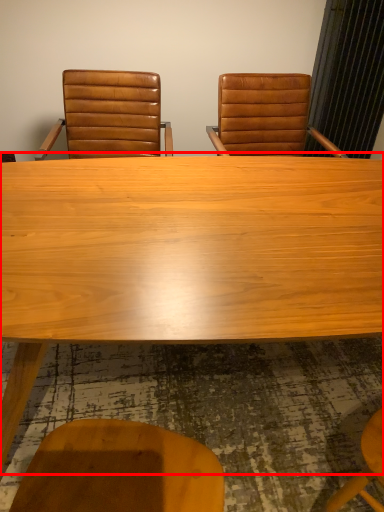
Question: From the image, what is the correct spatial relationship of table (annotated by the red box) in relation to chair?

Choices:
 (A) left
 (B) right

Answer: (B)